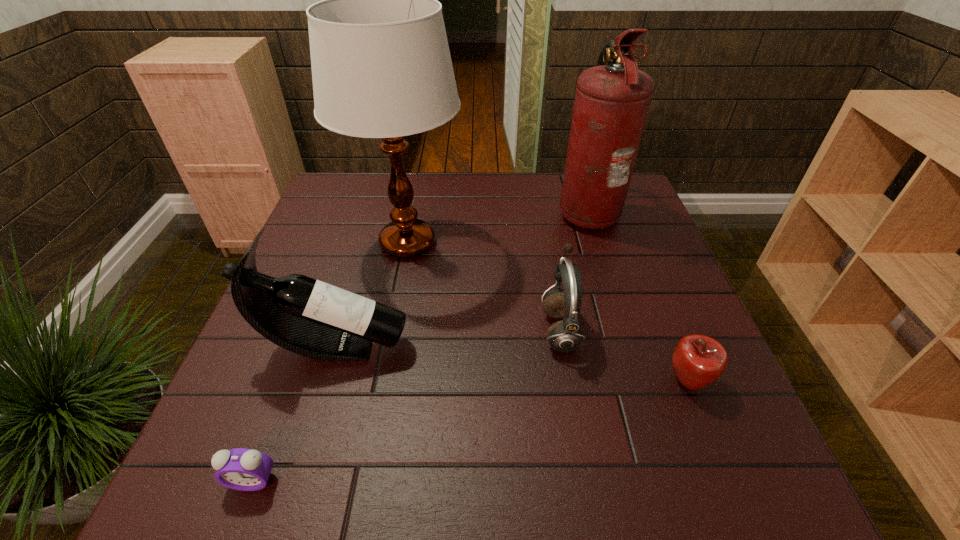
You are a GUI agent. You are given a task and a screenshot of the screen. Output one action in this format:
    pyautogui.click(x=<x>, y=<y>)
    Task: Click on the vacant area that lies between the fifth farthest object and the third shortest object
    
    Given the screenshot: What is the action you would take?
    pyautogui.click(x=624, y=355)

Locate which object ranks fifth in proximity to the apple. Please provide its 2D coordinates. Your answer should be formatted as a tuple, i.e. [(x, y)], where the tuple contains the x and y coordinates of a point satisfying the conditions above.

[(242, 469)]

At what (x,y) coordinates should I click in order to perform the action: click on the closest object relative to the third object from right to left. Please return your answer as a coordinate pair (x, y). Looking at the image, I should click on (698, 360).

The height and width of the screenshot is (540, 960). Identify the location of vacant area in the image that satisfies the following two spatial constraints: 1. on the ear pads of the third object from right to left; 2. on the face of the alarm clock. coord(586,481).

Identify the location of vacant region that satisfies the following two spatial constraints: 1. on the ear pads of the fifth tallest object; 2. on the right side of the third shortest object. click(568, 381).

Locate an element on the screen. The height and width of the screenshot is (540, 960). vacant space that satisfies the following two spatial constraints: 1. at the front of the fire extinguisher where the nozzle is aimed; 2. on the face of the nearest object is located at coordinates (670, 481).

I want to click on free point that satisfies the following two spatial constraints: 1. on the stand of the second nearest object; 2. on the right side of the third tallest object, so click(x=325, y=381).